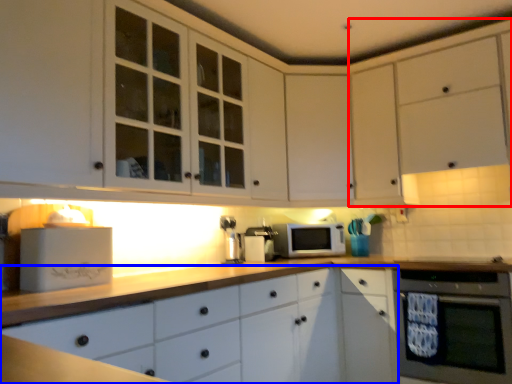
Question: Which object is closer to the camera taking this photo, cabinetry (highlighted by a red box) or cabinetry (highlighted by a blue box)?

Choices:
 (A) cabinetry
 (B) cabinetry

Answer: (B)